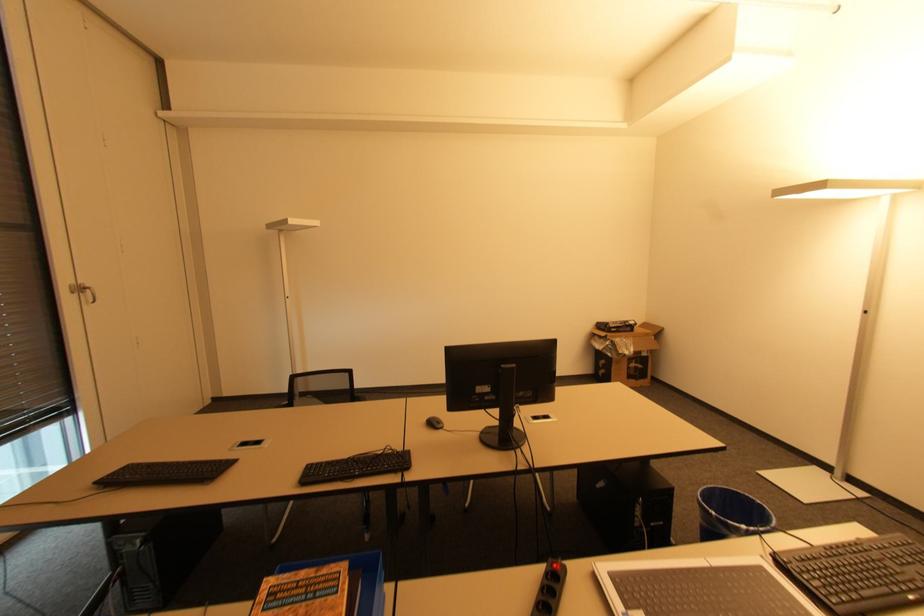
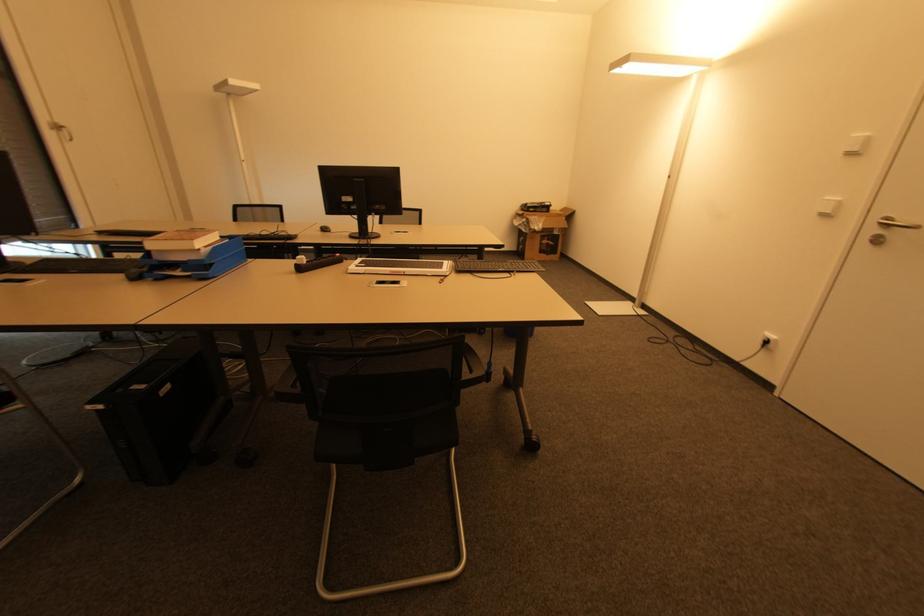
Where in the second image is the point corresponding to point 638,368 from the first image?

(550, 245)